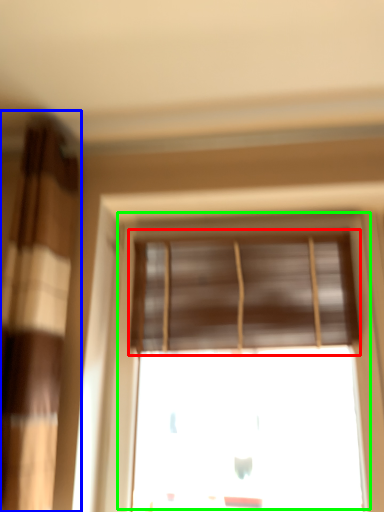
Question: Which object is the farthest from window blind (highlighted by a red box)? Choose among these: curtain (highlighted by a blue box) or window (highlighted by a green box).

Choices:
 (A) curtain
 (B) window

Answer: (A)